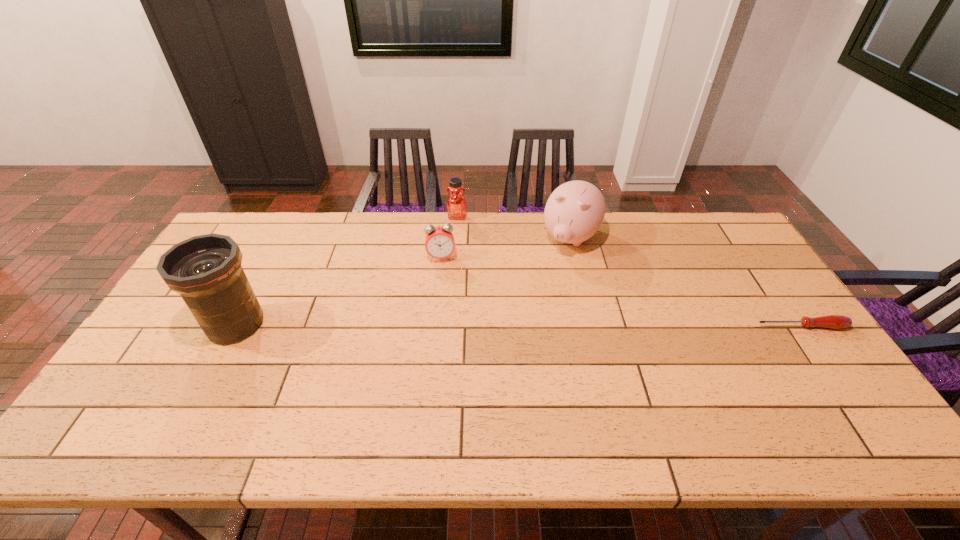
Locate an element on the screen. honey at the far edge is located at coordinates (456, 205).

Locate an element on the screen. The width and height of the screenshot is (960, 540). alarm clock at the far edge is located at coordinates (439, 241).

You are a GUI agent. You are given a task and a screenshot of the screen. Output one action in this format:
    pyautogui.click(x=<x>, y=<y>)
    Task: Click on the object located at the left edge
    
    Given the screenshot: What is the action you would take?
    pyautogui.click(x=206, y=271)

At what (x,y) coordinates should I click in order to perform the action: click on object that is positioned at the right edge. Please return your answer as a coordinate pair (x, y). The image size is (960, 540). Looking at the image, I should click on (831, 321).

At what (x,y) coordinates should I click in order to perform the action: click on vacant space at the far edge. Please return your answer as a coordinate pair (x, y). Looking at the image, I should click on (622, 231).

Image resolution: width=960 pixels, height=540 pixels. Find the location of `free point at the near edge`. free point at the near edge is located at coordinates (718, 400).

The width and height of the screenshot is (960, 540). Find the location of `vacant space at the right edge of the desktop`. vacant space at the right edge of the desktop is located at coordinates (767, 295).

Where is `free space at the far left corner of the desktop`? The height and width of the screenshot is (540, 960). free space at the far left corner of the desktop is located at coordinates (252, 240).

Locate an element on the screen. free space at the near left corner of the desktop is located at coordinates (125, 403).

I want to click on free spot between the fourth shortest object and the rightmost object, so click(685, 282).